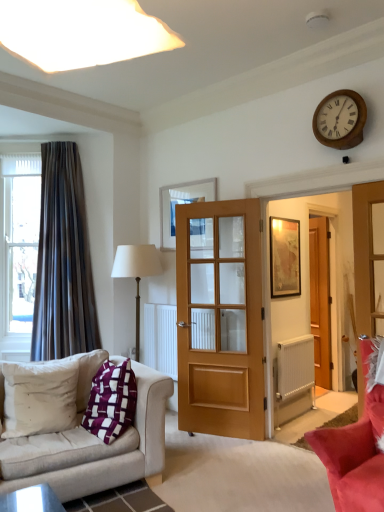
The image size is (384, 512). Identify the location of free space above white textured radiator at lower right (from a real-world perspective). (296, 336).